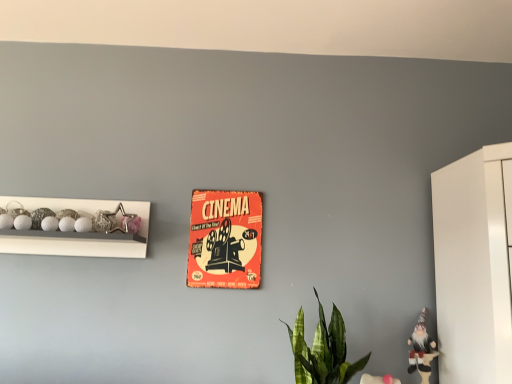
Where is `white fabric gnome at lower right, arranged as the 2th toy when viewed from the top`? This screenshot has height=384, width=512. white fabric gnome at lower right, arranged as the 2th toy when viewed from the top is located at coordinates (421, 349).

Describe the element at coordinates (421, 349) in the screenshot. The width and height of the screenshot is (512, 384). I see `white fabric gnome at lower right, arranged as the 2th toy when viewed from the top` at that location.

The height and width of the screenshot is (384, 512). What do you see at coordinates (76, 232) in the screenshot?
I see `white glossy beads at left` at bounding box center [76, 232].

Locate an element on the screen. Image resolution: width=512 pixels, height=384 pixels. orange paper poster at center is located at coordinates (225, 239).

Describe the element at coordinates (225, 239) in the screenshot. I see `orange paper poster at center` at that location.

The width and height of the screenshot is (512, 384). What do you see at coordinates (323, 351) in the screenshot?
I see `green leafy plant at lower center` at bounding box center [323, 351].

Image resolution: width=512 pixels, height=384 pixels. What are the coordinates of `white fabric gnome at lower right, arranged as the 2th toy when viewed from the top` in the screenshot? It's located at (421, 349).

From a real-world perspective, is orange paper poster at center above or below white glossy beads at left?

orange paper poster at center is situated lower than white glossy beads at left in the real world.

Consider the image. Considering the relative sizes of orange paper poster at center and white glossy beads at left in the image provided, is orange paper poster at center thinner than white glossy beads at left?

Indeed, orange paper poster at center has a lesser width compared to white glossy beads at left.

Is orange paper poster at center to the right of white glossy beads at left from the viewer's perspective?

Yes.

How many degrees apart are the facing directions of orange paper poster at center and white glossy beads at left?

0.0228 degrees.

Is white glossy beads at left to the left or to the right of white fabric gnome at lower right, which appears as the 1th toy when ordered from the bottom, in the image?

Based on their positions, white glossy beads at left is located to the left of white fabric gnome at lower right, which appears as the 1th toy when ordered from the bottom.

What's the angular difference between white glossy beads at left and white fabric gnome at lower right, which appears as the 1th toy when ordered from the bottom,'s facing directions?

2.71 degrees.

Who is taller, white glossy beads at left or white fabric gnome at lower right, the second toy from the left?

white fabric gnome at lower right, the second toy from the left.

Is white glossy beads at left bigger or smaller than white fabric gnome at lower right, which appears as the 1th toy when ordered from the bottom?

white glossy beads at left is bigger than white fabric gnome at lower right, which appears as the 1th toy when ordered from the bottom.

Is point (57, 243) behind point (233, 252)?

That is False.

From the image's perspective, is white glossy beads at left on top of orange paper poster at center?

Correct, white glossy beads at left appears higher than orange paper poster at center in the image.

Identify the location of shelf lying above the orange paper poster at center (from the image's perspective). (76, 232).

Is white glossy beads at left not near orange paper poster at center?

No, white glossy beads at left is in close proximity to orange paper poster at center.

Who is smaller, white glossy beads at left or metallic star at left, which appears as the first toy when viewed from the left?

metallic star at left, which appears as the first toy when viewed from the left.

From the image's perspective, would you say white glossy beads at left is positioned over metallic star at left, arranged as the first toy when viewed from the top?

Actually, white glossy beads at left appears below metallic star at left, arranged as the first toy when viewed from the top, in the image.

In the scene shown: Looking at their sizes, would you say white glossy beads at left is wider or thinner than metallic star at left, the 2th toy when ordered from right to left?

A: Clearly, white glossy beads at left has more width compared to metallic star at left, the 2th toy when ordered from right to left.

Is white glossy beads at left not close to metallic star at left, arranged as the first toy when viewed from the top?

white glossy beads at left is near metallic star at left, arranged as the first toy when viewed from the top, not far away.

Considering the relative positions of green leafy plant at lower center and white fabric gnome at lower right, which appears as the first toy when viewed from the right, in the image provided, is green leafy plant at lower center to the left of white fabric gnome at lower right, which appears as the first toy when viewed from the right, from the viewer's perspective?

Yes, green leafy plant at lower center is to the left of white fabric gnome at lower right, which appears as the first toy when viewed from the right.

Who is bigger, green leafy plant at lower center or white fabric gnome at lower right, which appears as the 1th toy when ordered from the bottom?

green leafy plant at lower center.

From a real-world perspective, between green leafy plant at lower center and white fabric gnome at lower right, the second toy from the left, who is vertically lower?

white fabric gnome at lower right, the second toy from the left, from a real-world perspective.

Which of these two, green leafy plant at lower center or white fabric gnome at lower right, which appears as the 1th toy when ordered from the bottom, stands shorter?

white fabric gnome at lower right, which appears as the 1th toy when ordered from the bottom.

Is white fabric gnome at lower right, which appears as the 1th toy when ordered from the bottom, beside white glossy beads at left?

No, white fabric gnome at lower right, which appears as the 1th toy when ordered from the bottom, is not with white glossy beads at left.

Can you confirm if white fabric gnome at lower right, the second toy from the left, is taller than white glossy beads at left?

Yes.

Is white fabric gnome at lower right, the second toy from the left, aimed at white glossy beads at left?

No, white fabric gnome at lower right, the second toy from the left, does not turn towards white glossy beads at left.

Relative to white fabric gnome at lower right, the second toy from the left, is metallic star at left, which is the second toy in bottom-to-top order, in front or behind?

Visually, metallic star at left, which is the second toy in bottom-to-top order, is located behind white fabric gnome at lower right, the second toy from the left.

Does metallic star at left, the 2th toy when ordered from right to left, have a lesser width compared to white fabric gnome at lower right, which appears as the 1th toy when ordered from the bottom?

Yes.

From a real-world perspective, between metallic star at left, the 2th toy when ordered from right to left, and white fabric gnome at lower right, arranged as the 2th toy when viewed from the top, who is vertically higher?

metallic star at left, the 2th toy when ordered from right to left.

Is metallic star at left, the 2th toy when ordered from right to left, turned away from white fabric gnome at lower right, arranged as the 2th toy when viewed from the top?

No, metallic star at left, the 2th toy when ordered from right to left, is not facing away from white fabric gnome at lower right, arranged as the 2th toy when viewed from the top.

This screenshot has height=384, width=512. In the image, there is a orange paper poster at center. Identify the location of shelf above it (from the image's perspective). (76, 232).

In order to click on toy below the white glossy beads at left (from a real-world perspective) in this screenshot , I will do (421, 349).

Based on their spatial positions, is metallic star at left, which is the second toy in bottom-to-top order, or white fabric gnome at lower right, arranged as the 2th toy when viewed from the top, further from orange paper poster at center?

Based on the image, white fabric gnome at lower right, arranged as the 2th toy when viewed from the top, appears to be further to orange paper poster at center.

Looking at the image, which one is located further to metallic star at left, which appears as the first toy when viewed from the left, white fabric gnome at lower right, arranged as the 2th toy when viewed from the top, or orange paper poster at center?

white fabric gnome at lower right, arranged as the 2th toy when viewed from the top, lies further to metallic star at left, which appears as the first toy when viewed from the left, than the other object.

When comparing their distances from orange paper poster at center, does white fabric gnome at lower right, which appears as the 1th toy when ordered from the bottom, or metallic star at left, which appears as the first toy when viewed from the left, seem closer?

Among the two, metallic star at left, which appears as the first toy when viewed from the left, is located nearer to orange paper poster at center.

Estimate the real-world distances between objects in this image. Which object is closer to green leafy plant at lower center, orange paper poster at center or metallic star at left, which appears as the first toy when viewed from the left?

Based on the image, orange paper poster at center appears to be nearer to green leafy plant at lower center.

When comparing their distances from metallic star at left, the 2th toy when ordered from right to left, does orange paper poster at center or white fabric gnome at lower right, the second toy from the left, seem further?

Among the two, white fabric gnome at lower right, the second toy from the left, is located further to metallic star at left, the 2th toy when ordered from right to left.

Considering their positions, is metallic star at left, arranged as the first toy when viewed from the top, positioned further to white glossy beads at left than green leafy plant at lower center?

Among the two, green leafy plant at lower center is located further to white glossy beads at left.

Looking at the image, which one is located closer to green leafy plant at lower center, orange paper poster at center or white glossy beads at left?

orange paper poster at center is closer to green leafy plant at lower center.

When comparing their distances from white fabric gnome at lower right, arranged as the 2th toy when viewed from the top, does metallic star at left, which appears as the first toy when viewed from the left, or orange paper poster at center seem further?

Based on the image, metallic star at left, which appears as the first toy when viewed from the left, appears to be further to white fabric gnome at lower right, arranged as the 2th toy when viewed from the top.

Find the location of a particular element. The width and height of the screenshot is (512, 384). toy between white glossy beads at left and green leafy plant at lower center in the horizontal direction is located at coordinates (116, 221).

The height and width of the screenshot is (384, 512). What are the coordinates of `postcard between white glossy beads at left and green leafy plant at lower center from left to right` in the screenshot? It's located at (225, 239).

The height and width of the screenshot is (384, 512). In order to click on houseplant between metallic star at left, the 2th toy when ordered from right to left, and white fabric gnome at lower right, which appears as the 1th toy when ordered from the bottom in this screenshot , I will do `click(323, 351)`.

The width and height of the screenshot is (512, 384). I want to click on toy between white glossy beads at left and orange paper poster at center from left to right, so click(x=116, y=221).